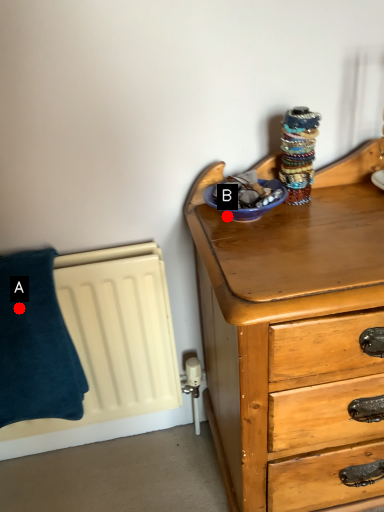
Question: Two points are circled on the image, labeled by A and B beside each circle. Among these points, which one is nearest to the camera?

Choices:
 (A) A is closer
 (B) B is closer

Answer: (B)